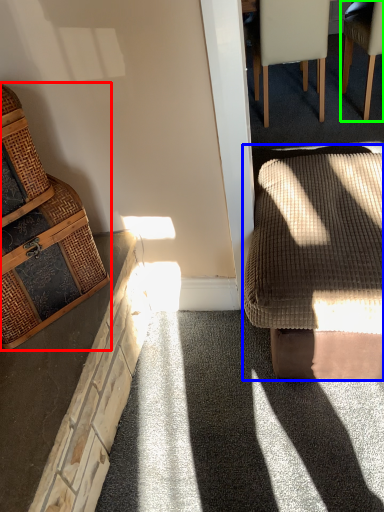
Question: Estimate the real-world distances between objects in this image. Which object is farther from chair (highlighted by a red box), rocking chair (highlighted by a blue box) or chair (highlighted by a green box)?

Choices:
 (A) rocking chair
 (B) chair

Answer: (B)